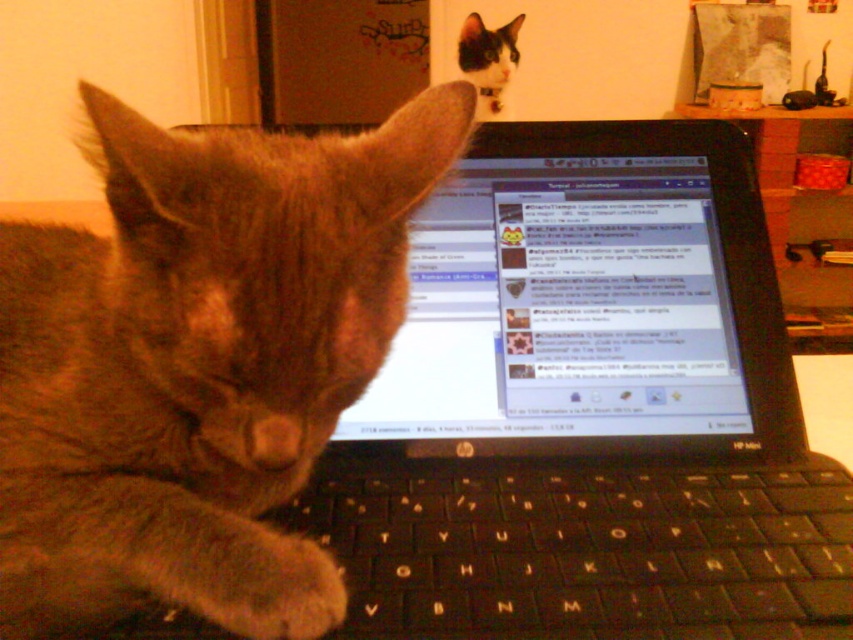
Question: Which object is farther from the camera taking this photo?

Choices:
 (A) shiny black laptop at center
 (B) black plastic laptop at center

Answer: (A)

Question: Among these points, which one is nearest to the camera?

Choices:
 (A) (775, 22)
 (B) (305, 593)
 (C) (489, 81)
 (D) (320, 552)

Answer: (B)

Question: Which object appears farthest from the camera in this image?

Choices:
 (A) black plastic keyboard at lower center
 (B) fuzzy fur paw at keyboard center

Answer: (A)

Question: In this image, where is black plastic laptop at center located relative to fuzzy brown cat at center?

Choices:
 (A) above
 (B) below

Answer: (B)

Question: Considering the relative positions of black plastic laptop at center and black plastic keyboard at lower center in the image provided, where is black plastic laptop at center located with respect to black plastic keyboard at lower center?

Choices:
 (A) left
 (B) right

Answer: (B)

Question: Is black plastic laptop at center bigger than black plastic keyboard at lower center?

Choices:
 (A) no
 (B) yes

Answer: (B)